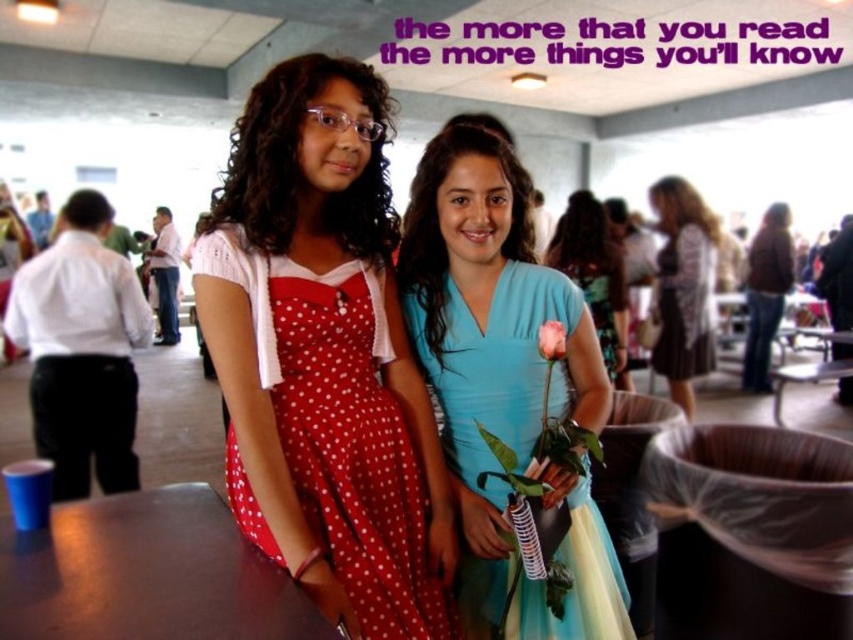
Who is positioned more to the right, brown textured dress at center or brown leather jacket at center?

Positioned to the right is brown leather jacket at center.

Does brown textured dress at center lie behind brown leather jacket at center?

No, it is not.

Describe the element at coordinates (683, 285) in the screenshot. The image size is (853, 640). I see `brown textured dress at center` at that location.

You are a GUI agent. You are given a task and a screenshot of the screen. Output one action in this format:
    pyautogui.click(x=<x>, y=<y>)
    Task: Click on the brown textured dress at center
    This screenshot has height=640, width=853.
    Given the screenshot: What is the action you would take?
    pyautogui.click(x=683, y=285)

Which is behind, point (384, 582) or point (543, 348)?

The point (384, 582) is more distant.

Does red polka dot dress at center appear over pink matte rose at center?

Answer: Actually, red polka dot dress at center is below pink matte rose at center.

Find the location of a particular element. This screenshot has height=640, width=853. red polka dot dress at center is located at coordinates (323, 356).

Image resolution: width=853 pixels, height=640 pixels. What are the coordinates of `red polka dot dress at center` in the screenshot? It's located at (323, 356).

Describe the element at coordinates (323, 356) in the screenshot. The width and height of the screenshot is (853, 640). I see `red polka dot dress at center` at that location.

Does red polka dot dress at center appear over matte blue dress at center?

No.

Is point (369, 358) positioned before point (589, 248)?

Yes.

Where is `red polka dot dress at center`? red polka dot dress at center is located at coordinates (323, 356).